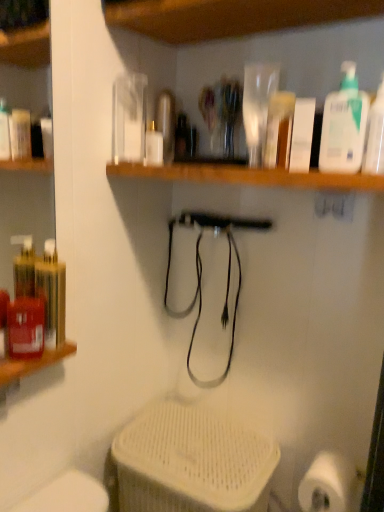
Find the location of a particular element. white plastic pump bottle at upper right, positioned as the 2th cleaning product in right-to-left order is located at coordinates (344, 125).

At what (x,y) coordinates should I click in order to perform the action: click on translucent plastic bottle at upper right, the first cleaning product from the right. Please return your answer as a coordinate pair (x, y). Image resolution: width=384 pixels, height=512 pixels. Looking at the image, I should click on (375, 135).

In order to face translucent plastic bottle at upper right, the first cleaning product from the right, should I rotate leftwards or rightwards?

A 24.278 degree turn to the right will do.

The image size is (384, 512). What are the coordinates of `white plastic pump bottle at upper right, positioned as the 2th cleaning product in right-to-left order` in the screenshot? It's located at (344, 125).

Between white matte toilet paper at lower right and white plastic pump bottle at upper right, arranged as the first cleaning product when viewed from the left, which one is positioned behind?

white matte toilet paper at lower right is behind.

Considering the sizes of objects white matte toilet paper at lower right and white plastic pump bottle at upper right, positioned as the 2th cleaning product in right-to-left order, in the image provided, who is thinner, white matte toilet paper at lower right or white plastic pump bottle at upper right, positioned as the 2th cleaning product in right-to-left order,?

Thinner between the two is white plastic pump bottle at upper right, positioned as the 2th cleaning product in right-to-left order.

Is white matte toilet paper at lower right beside white plastic pump bottle at upper right, positioned as the 2th cleaning product in right-to-left order?

white matte toilet paper at lower right and white plastic pump bottle at upper right, positioned as the 2th cleaning product in right-to-left order, are not in contact.

Is white matte toilet paper at lower right completely or partially outside of white plastic pump bottle at upper right, arranged as the first cleaning product when viewed from the left?

white matte toilet paper at lower right is positioned outside white plastic pump bottle at upper right, arranged as the first cleaning product when viewed from the left.

Which of these two, translucent plastic bottle at upper right, marked as the 2th cleaning product in a left-to-right arrangement, or white plastic pump bottle at upper right, arranged as the first cleaning product when viewed from the left, stands taller?

white plastic pump bottle at upper right, arranged as the first cleaning product when viewed from the left.

Considering their positions, is translucent plastic bottle at upper right, marked as the 2th cleaning product in a left-to-right arrangement, located in front of or behind white plastic pump bottle at upper right, arranged as the first cleaning product when viewed from the left?

translucent plastic bottle at upper right, marked as the 2th cleaning product in a left-to-right arrangement, is positioned closer to the viewer than white plastic pump bottle at upper right, arranged as the first cleaning product when viewed from the left.

Is the surface of translucent plastic bottle at upper right, marked as the 2th cleaning product in a left-to-right arrangement, in direct contact with white plastic pump bottle at upper right, arranged as the first cleaning product when viewed from the left?

Yes, translucent plastic bottle at upper right, marked as the 2th cleaning product in a left-to-right arrangement, is with white plastic pump bottle at upper right, arranged as the first cleaning product when viewed from the left.

Which object is positioned more to the right, white matte bottle at center or white matte toilet paper at lower right?

From the viewer's perspective, white matte toilet paper at lower right appears more on the right side.

Considering the points (151, 147) and (318, 467), which point is behind, point (151, 147) or point (318, 467)?

The point (151, 147) is behind.

Is white matte toilet paper at lower right inside white matte bottle at center?

No, white matte toilet paper at lower right is not inside white matte bottle at center.

In the scene shown: From the image's perspective, which is above, white matte bottle at center or white matte toilet paper at lower right?

white matte bottle at center, from the image's perspective.

Is white plastic pump bottle at upper right, positioned as the 2th cleaning product in right-to-left order, positioned far away from white matte toilet paper at lower right?

No, there isn't a large distance between white plastic pump bottle at upper right, positioned as the 2th cleaning product in right-to-left order, and white matte toilet paper at lower right.

Considering the sizes of objects white plastic pump bottle at upper right, positioned as the 2th cleaning product in right-to-left order, and white matte toilet paper at lower right in the image provided, who is wider, white plastic pump bottle at upper right, positioned as the 2th cleaning product in right-to-left order, or white matte toilet paper at lower right?

white matte toilet paper at lower right is wider.

Is white plastic pump bottle at upper right, positioned as the 2th cleaning product in right-to-left order, to the right of white matte toilet paper at lower right from the viewer's perspective?

In fact, white plastic pump bottle at upper right, positioned as the 2th cleaning product in right-to-left order, is to the left of white matte toilet paper at lower right.

From the image's perspective, who appears lower, white plastic pump bottle at upper right, arranged as the first cleaning product when viewed from the left, or white matte toilet paper at lower right?

white matte toilet paper at lower right appears lower in the image.

Can you confirm if white plastic pump bottle at upper right, positioned as the 2th cleaning product in right-to-left order, is thinner than translucent plastic bottle at upper right, the first cleaning product from the right?

Yes, white plastic pump bottle at upper right, positioned as the 2th cleaning product in right-to-left order, is thinner than translucent plastic bottle at upper right, the first cleaning product from the right.

Which is correct: white plastic pump bottle at upper right, arranged as the first cleaning product when viewed from the left, is inside translucent plastic bottle at upper right, the first cleaning product from the right, or outside of it?

white plastic pump bottle at upper right, arranged as the first cleaning product when viewed from the left, lies outside translucent plastic bottle at upper right, the first cleaning product from the right.

From a real-world perspective, is white plastic pump bottle at upper right, arranged as the first cleaning product when viewed from the left, on top of translucent plastic bottle at upper right, marked as the 2th cleaning product in a left-to-right arrangement?

Yes, from a real-world perspective, white plastic pump bottle at upper right, arranged as the first cleaning product when viewed from the left, is above translucent plastic bottle at upper right, marked as the 2th cleaning product in a left-to-right arrangement.

Relative to translucent plastic bottle at upper right, the first cleaning product from the right, is white matte bottle at center in front or behind?

Visually, white matte bottle at center is located behind translucent plastic bottle at upper right, the first cleaning product from the right.

Does white matte bottle at center have a greater height compared to translucent plastic bottle at upper right, marked as the 2th cleaning product in a left-to-right arrangement?

No, white matte bottle at center is not taller than translucent plastic bottle at upper right, marked as the 2th cleaning product in a left-to-right arrangement.

How far apart are white matte bottle at center and translucent plastic bottle at upper right, the first cleaning product from the right?

white matte bottle at center is 19.24 inches from translucent plastic bottle at upper right, the first cleaning product from the right.

Considering the sizes of objects translucent plastic bottle at upper right, the first cleaning product from the right, and white matte toilet paper at lower right in the image provided, who is shorter, translucent plastic bottle at upper right, the first cleaning product from the right, or white matte toilet paper at lower right?

Standing shorter between the two is white matte toilet paper at lower right.

Locate an element on the screen. toilet paper on the left of translucent plastic bottle at upper right, the first cleaning product from the right is located at coordinates (327, 484).

Can you confirm if translucent plastic bottle at upper right, marked as the 2th cleaning product in a left-to-right arrangement, is positioned to the left of white matte toilet paper at lower right?

In fact, translucent plastic bottle at upper right, marked as the 2th cleaning product in a left-to-right arrangement, is to the right of white matte toilet paper at lower right.

Is translucent plastic bottle at upper right, marked as the 2th cleaning product in a left-to-right arrangement, bigger than white matte toilet paper at lower right?

Incorrect, translucent plastic bottle at upper right, marked as the 2th cleaning product in a left-to-right arrangement, is not larger than white matte toilet paper at lower right.

The height and width of the screenshot is (512, 384). What are the coordinates of `toilet paper below the white plastic pump bottle at upper right, positioned as the 2th cleaning product in right-to-left order (from the image's perspective)` in the screenshot? It's located at (327, 484).

This screenshot has height=512, width=384. Identify the location of cleaning product to the right of white plastic pump bottle at upper right, positioned as the 2th cleaning product in right-to-left order. (375, 135).

Looking at the image, which one is located closer to white matte bottle at center, translucent plastic bottle at upper right, the first cleaning product from the right, or white matte toilet paper at lower right?

Based on the image, translucent plastic bottle at upper right, the first cleaning product from the right, appears to be nearer to white matte bottle at center.

Looking at the image, which one is located further to white matte bottle at center, white plastic pump bottle at upper right, positioned as the 2th cleaning product in right-to-left order, or white matte toilet paper at lower right?

white matte toilet paper at lower right is positioned further to the anchor white matte bottle at center.

When comparing their distances from white matte toilet paper at lower right, does white matte bottle at center or white plastic pump bottle at upper right, arranged as the first cleaning product when viewed from the left, seem closer?

Based on the image, white plastic pump bottle at upper right, arranged as the first cleaning product when viewed from the left, appears to be nearer to white matte toilet paper at lower right.

When comparing their distances from white matte toilet paper at lower right, does white plastic pump bottle at upper right, positioned as the 2th cleaning product in right-to-left order, or translucent plastic bottle at upper right, marked as the 2th cleaning product in a left-to-right arrangement, seem further?

white plastic pump bottle at upper right, positioned as the 2th cleaning product in right-to-left order, is further to white matte toilet paper at lower right.

Looking at the image, which one is located closer to translucent plastic bottle at upper right, the first cleaning product from the right, white plastic pump bottle at upper right, positioned as the 2th cleaning product in right-to-left order, or white matte toilet paper at lower right?

Based on the image, white plastic pump bottle at upper right, positioned as the 2th cleaning product in right-to-left order, appears to be nearer to translucent plastic bottle at upper right, the first cleaning product from the right.

When comparing their distances from white plastic pump bottle at upper right, positioned as the 2th cleaning product in right-to-left order, does white matte bottle at center or white matte toilet paper at lower right seem further?

white matte toilet paper at lower right.

Looking at the image, which one is located further to white matte bottle at center, white matte toilet paper at lower right or translucent plastic bottle at upper right, marked as the 2th cleaning product in a left-to-right arrangement?

white matte toilet paper at lower right is further to white matte bottle at center.

Based on their spatial positions, is translucent plastic bottle at upper right, the first cleaning product from the right, or white matte toilet paper at lower right further from white plastic pump bottle at upper right, arranged as the first cleaning product when viewed from the left?

Among the two, white matte toilet paper at lower right is located further to white plastic pump bottle at upper right, arranged as the first cleaning product when viewed from the left.

I want to click on cleaning product between white plastic pump bottle at upper right, arranged as the first cleaning product when viewed from the left, and white matte toilet paper at lower right in the up-down direction, so click(x=375, y=135).

At what (x,y) coordinates should I click in order to perform the action: click on cleaning product between white matte bottle at center and translucent plastic bottle at upper right, the first cleaning product from the right. Please return your answer as a coordinate pair (x, y). The width and height of the screenshot is (384, 512). Looking at the image, I should click on (344, 125).